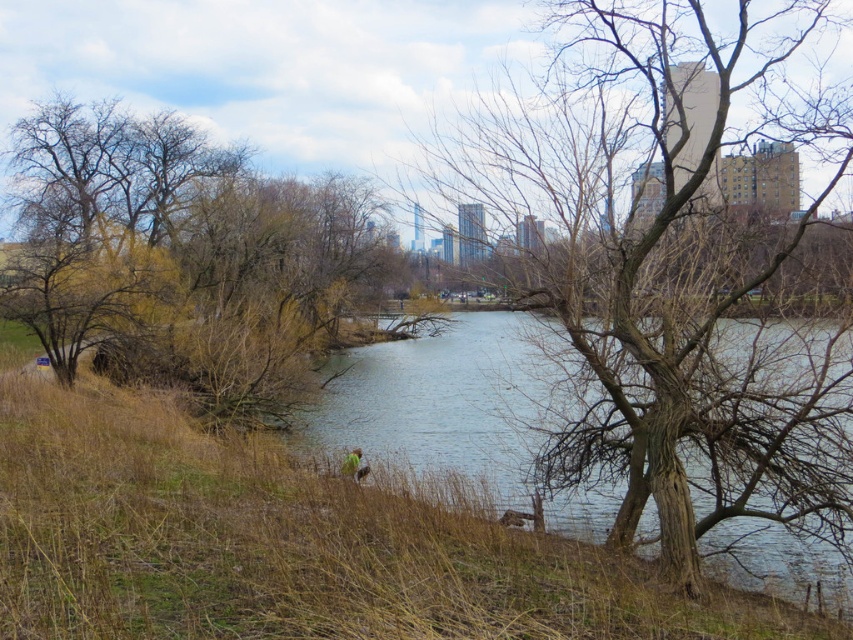
Identify the location of clear water at center. The width and height of the screenshot is (853, 640). (450, 403).

Is point (830, 572) positioned after point (361, 476)?

Yes.

Where is `clear water at center`? clear water at center is located at coordinates (450, 403).

Is point (277, 198) more distant than point (347, 474)?

Yes, point (277, 198) is behind point (347, 474).

Who is more distant from viewer, (96, 184) or (358, 449)?

The point (96, 184) is behind.

Where is `brown leafy tree at left`? The width and height of the screenshot is (853, 640). brown leafy tree at left is located at coordinates (181, 257).

Which of these two, bare wood tree at center or green grass at lower center, stands shorter?

With less height is green grass at lower center.

Is point (738, 291) positioned after point (357, 472)?

No, (738, 291) is closer to viewer.

Who is more forward, (766, 257) or (355, 474)?

Point (766, 257) is in front.

Where is `bare wood tree at center`? Image resolution: width=853 pixels, height=640 pixels. bare wood tree at center is located at coordinates (666, 273).